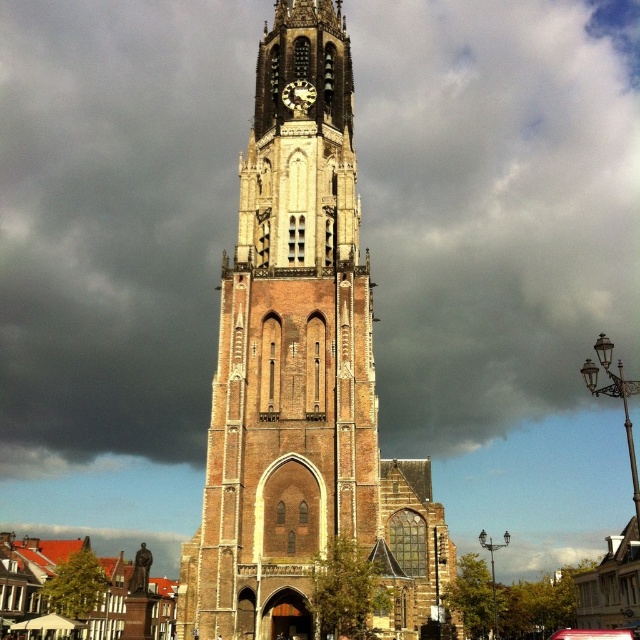
You are standing at the base of the brown brick tower at center and want to place a decorative flagpole that is 10 meters tall. The wooden clock face at center is located at the top of the tower. Can the flagpole be placed on top of the tower without exceeding its height?

The brown brick tower at center has a greater height compared to the wooden clock face at center. Since the flagpole is 10 meters tall, it can be placed on top of the tower as the tower itself is taller than the clock face, providing sufficient space.

Based on the coordinates provided in the image, where is the brown brick tower at center located in terms of its 2D position?

The brown brick tower at center is located at the 2D coordinates point (x=301, y=376).